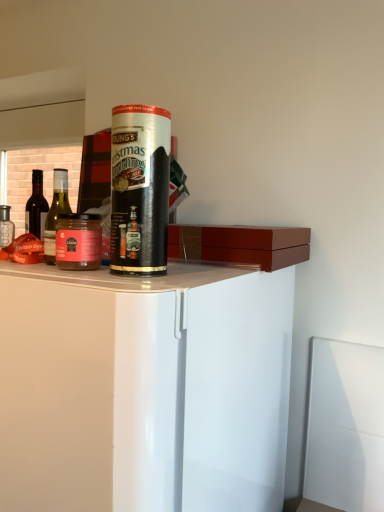
Question: Does white glossy cabinet at center lie in front of green glass bottle at left, acting as the 1th bottle starting from the front?

Choices:
 (A) no
 (B) yes

Answer: (B)

Question: From the image's perspective, would you say white glossy cabinet at center is shown under green glass bottle at left, which is the 2th bottle from left to right?

Choices:
 (A) yes
 (B) no

Answer: (A)

Question: Are white glossy cabinet at center and green glass bottle at left, which is the second bottle in back-to-front order, far apart?

Choices:
 (A) yes
 (B) no

Answer: (A)

Question: Is white glossy cabinet at center smaller than green glass bottle at left, which is the second bottle in back-to-front order?

Choices:
 (A) no
 (B) yes

Answer: (A)

Question: Is white glossy cabinet at center to the right of green glass bottle at left, acting as the 1th bottle starting from the front, from the viewer's perspective?

Choices:
 (A) yes
 (B) no

Answer: (A)

Question: Considering the relative positions of white glossy cabinet at center and green glass bottle at left, acting as the 1th bottle starting from the front, in the image provided, is white glossy cabinet at center to the left of green glass bottle at left, acting as the 1th bottle starting from the front, from the viewer's perspective?

Choices:
 (A) no
 (B) yes

Answer: (A)

Question: Considering the relative sizes of matte glass jar at left and transparent plastic straw at center in the image provided, is matte glass jar at left taller than transparent plastic straw at center?

Choices:
 (A) no
 (B) yes

Answer: (A)

Question: Does matte glass jar at left have a smaller size compared to transparent plastic straw at center?

Choices:
 (A) no
 (B) yes

Answer: (B)

Question: From the image's perspective, is matte glass jar at left above transparent plastic straw at center?

Choices:
 (A) yes
 (B) no

Answer: (B)

Question: Does matte glass jar at left lie behind transparent plastic straw at center?

Choices:
 (A) no
 (B) yes

Answer: (B)

Question: Considering the relative sizes of matte glass jar at left and transparent plastic straw at center in the image provided, is matte glass jar at left shorter than transparent plastic straw at center?

Choices:
 (A) no
 (B) yes

Answer: (B)

Question: Considering the relative positions of matte glass jar at left and transparent plastic straw at center in the image provided, is matte glass jar at left in front of transparent plastic straw at center?

Choices:
 (A) yes
 (B) no

Answer: (B)

Question: Considering the relative positions of matte glass bottle at left, which is the 1th bottle from back to front, and transparent plastic straw at center in the image provided, is matte glass bottle at left, which is the 1th bottle from back to front, to the right of transparent plastic straw at center from the viewer's perspective?

Choices:
 (A) no
 (B) yes

Answer: (A)